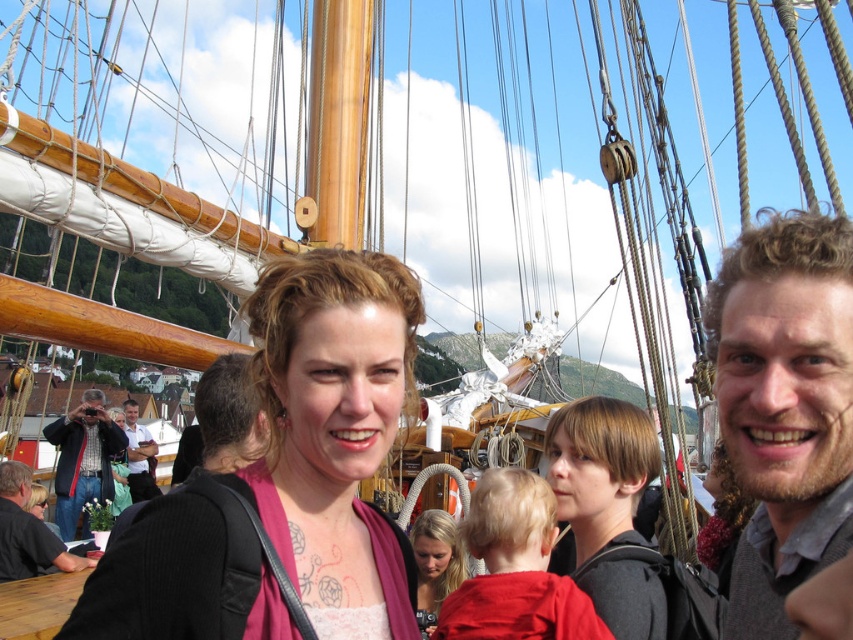
Based on the coordinates provided, which person in the image is located at point (784, 406)?

The person at point (784, 406) is the curly hair man at right.